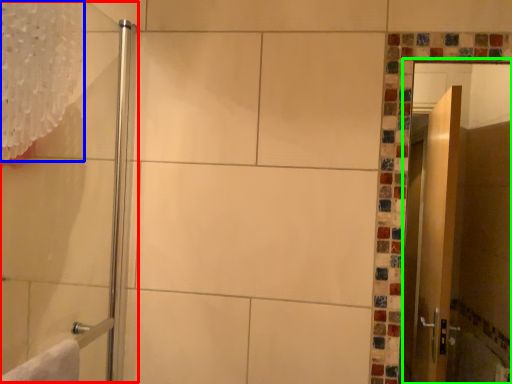
Question: Considering the real-world distances, which object is closest to shower door (highlighted by a red box)? shower curtain (highlighted by a blue box) or screen door (highlighted by a green box).

Choices:
 (A) shower curtain
 (B) screen door

Answer: (A)